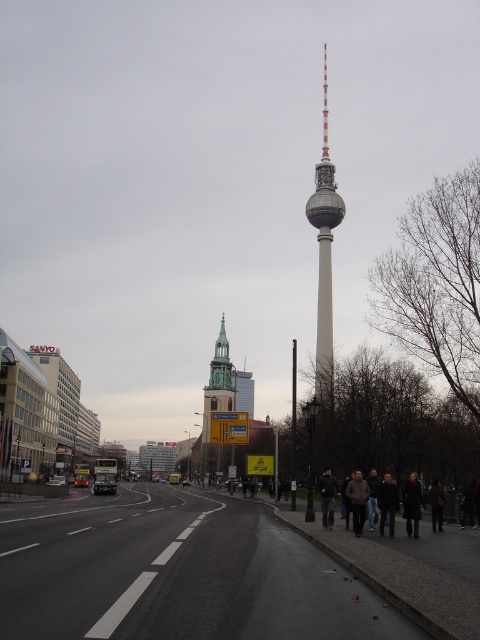
Based on the photo, you are a city planner assessing the distance between the white smooth tower at center and the green spire on the left. If the minimum required distance for safety regulations is 70 meters, is the current distance compliant?

The distance between the white smooth tower at center and the green spire on the left is 75.35 meters, which exceeds the 70 meters requirement, so it is compliant.

You are a city planner analyzing the urban layout. Given the white smooth tower at center and the dark gray jacket at center, which object occupies more horizontal space in the image?

The white smooth tower at center is wider than the dark gray jacket at center, so it occupies more horizontal space.

Consider the image. You are a tourist standing in the middle of the road looking at the white smooth tower at center and the green stone church steeple at center. Which one appears closer to you?

The white smooth tower at center appears closer to you because it is closer to the viewer than the green stone church steeple at center.